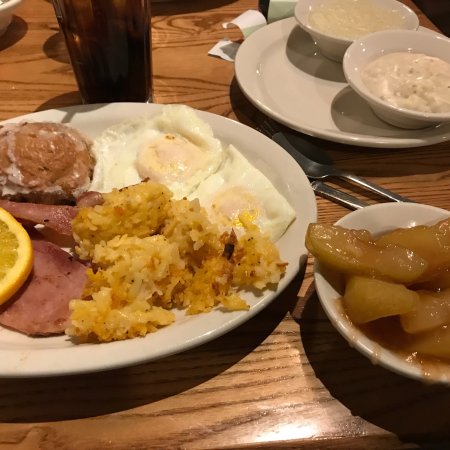
This screenshot has height=450, width=450. I want to click on plate, so point(336,126).